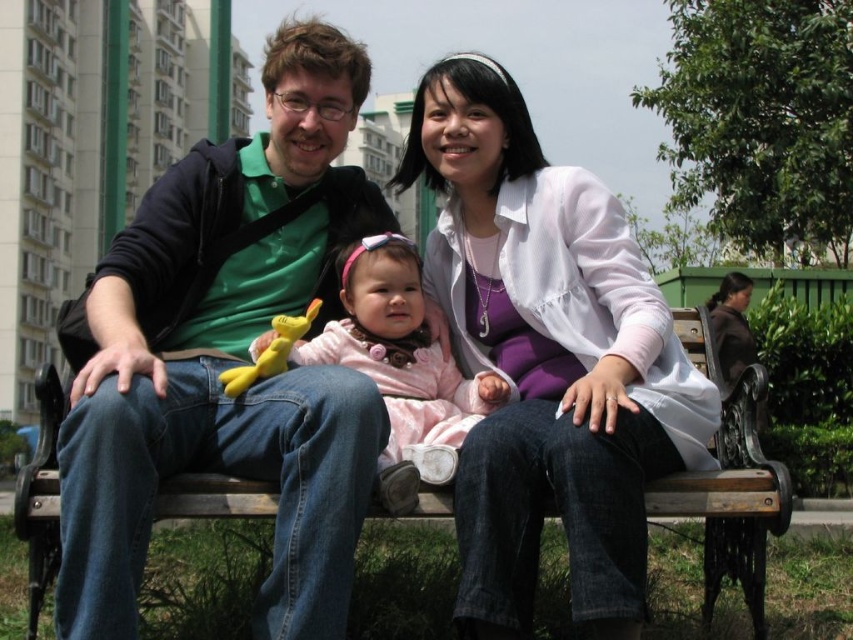
Does white matte jacket at center have a larger size compared to pink fabric baby at center?

Yes.

Does white matte jacket at center have a lesser width compared to pink fabric baby at center?

Incorrect, white matte jacket at center's width is not less than pink fabric baby at center's.

Find the location of a particular element. white matte jacket at center is located at coordinates (547, 358).

Which of these two, green matte shirt at left or white matte jacket at center, stands taller?

green matte shirt at left

Can you confirm if green matte shirt at left is wider than white matte jacket at center?

No, green matte shirt at left is not wider than white matte jacket at center.

Locate an element on the screen. The width and height of the screenshot is (853, 640). green matte shirt at left is located at coordinates (229, 356).

Does white matte jacket at center appear over wooden bench at center?

Correct, white matte jacket at center is located above wooden bench at center.

How far apart are white matte jacket at center and wooden bench at center?

They are 17.53 feet apart.

Between point (482, 301) and point (709, 618), which one is positioned in front?

Point (709, 618) is more forward.

Where is `white matte jacket at center`? white matte jacket at center is located at coordinates (547, 358).